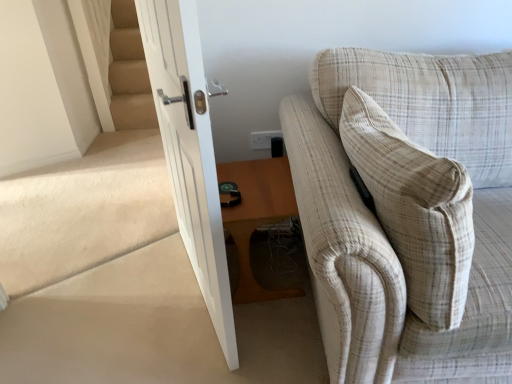
At what (x,y) coordinates should I click in order to perform the action: click on free space in front of wooden table at lower center. Please return your answer as a coordinate pair (x, y). The image size is (512, 384). Looking at the image, I should click on (273, 317).